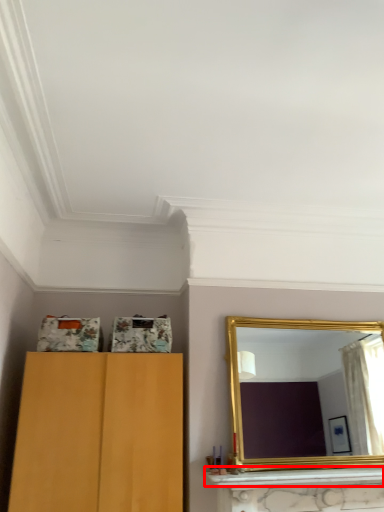
Question: In this image, where is mantle (annotated by the red box) located relative to mirror?

Choices:
 (A) right
 (B) left

Answer: (B)